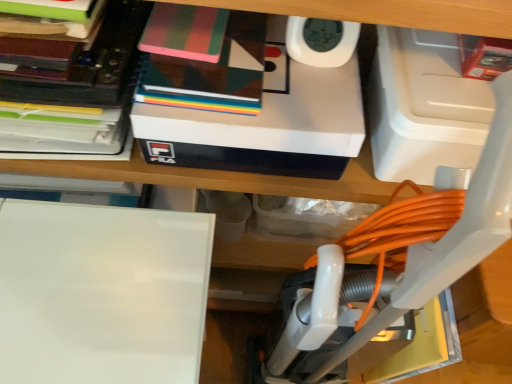
Question: Considering the positions of white matte box at upper center and white plastic vacuum at center in the image, is white matte box at upper center wider or thinner than white plastic vacuum at center?

Choices:
 (A) thin
 (B) wide

Answer: (A)

Question: From the image's perspective, is white matte box at upper center positioned above or below white plastic vacuum at center?

Choices:
 (A) below
 (B) above

Answer: (B)

Question: Considering the real-world distances, which object is farthest from the geometric-patterned notebook at upper center, which is the 2th book in left-to-right order?

Choices:
 (A) matte black book at upper left, which is the second book in right-to-left order
 (B) multicolored paper at upper center
 (C) white matte box at upper center
 (D) white plastic vacuum at center
 (E) white glossy board at lower left

Answer: (D)

Question: Estimate the real-world distances between objects in this image. Which object is closer to the white glossy board at lower left?

Choices:
 (A) multicolored paper at upper center
 (B) geometric-patterned notebook at upper center, the first book from the right
 (C) matte black book at upper left, which ranks as the first book in left-to-right order
 (D) white plastic vacuum at center
 (E) white matte box at upper center

Answer: (C)